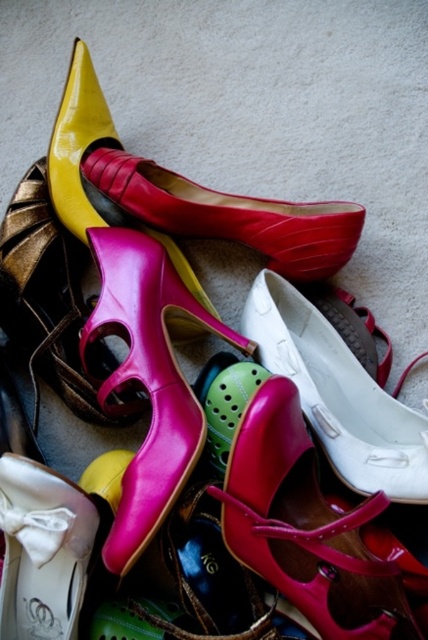
Question: Does white matte shoe at center appear on the right side of white satin shoe at lower left?

Choices:
 (A) yes
 (B) no

Answer: (A)

Question: Which point is farther to the camera?

Choices:
 (A) (109, 307)
 (B) (77, 509)

Answer: (A)

Question: Can you confirm if shiny pink sandal at center is positioned to the right of pink leather high-heeled shoe at center?

Choices:
 (A) no
 (B) yes

Answer: (B)

Question: Which point is closer to the camera taking this photo?

Choices:
 (A) (6, 481)
 (B) (115, 253)
 (C) (344, 465)
 (D) (311, 449)

Answer: (A)

Question: Which point is farther to the camera?

Choices:
 (A) (356, 410)
 (B) (240, 488)
 (C) (232, 230)
 (D) (44, 292)

Answer: (D)

Question: Can you confirm if white matte shoe at center is positioned below pink leather high-heeled shoe at center?

Choices:
 (A) yes
 (B) no

Answer: (A)